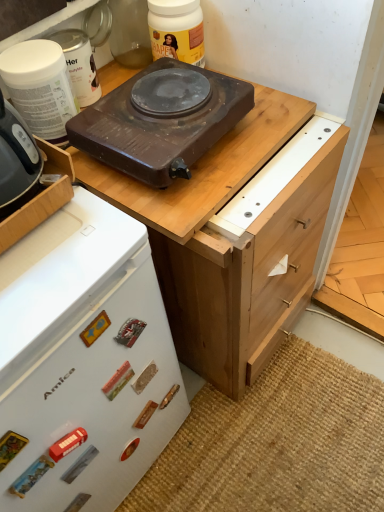
Question: Does brown wooden chest of drawers at upper center have a larger size compared to light brown wood drawer at right?

Choices:
 (A) yes
 (B) no

Answer: (A)

Question: Does brown wooden chest of drawers at upper center touch light brown wood drawer at right?

Choices:
 (A) yes
 (B) no

Answer: (A)

Question: Considering the relative positions of brown wooden chest of drawers at upper center and light brown wood drawer at right in the image provided, is brown wooden chest of drawers at upper center to the right of light brown wood drawer at right from the viewer's perspective?

Choices:
 (A) yes
 (B) no

Answer: (B)

Question: Is brown wooden chest of drawers at upper center turned away from light brown wood drawer at right?

Choices:
 (A) yes
 (B) no

Answer: (B)

Question: From the image's perspective, is brown wooden chest of drawers at upper center over light brown wood drawer at right?

Choices:
 (A) no
 (B) yes

Answer: (A)

Question: Is brown wooden chest of drawers at upper center in front of light brown wood drawer at right?

Choices:
 (A) yes
 (B) no

Answer: (A)

Question: Is brown wooden chest of drawers at upper center to the right of brown matte electric stove at upper center, the 3th kitchen appliance viewed from the left, from the viewer's perspective?

Choices:
 (A) yes
 (B) no

Answer: (A)

Question: Is brown wooden chest of drawers at upper center oriented towards brown matte electric stove at upper center, positioned as the second kitchen appliance in right-to-left order?

Choices:
 (A) no
 (B) yes

Answer: (A)

Question: Is brown wooden chest of drawers at upper center closer to the viewer compared to brown matte electric stove at upper center, the 3th kitchen appliance viewed from the left?

Choices:
 (A) yes
 (B) no

Answer: (B)

Question: Can you confirm if brown wooden chest of drawers at upper center is thinner than brown matte electric stove at upper center, positioned as the second kitchen appliance in right-to-left order?

Choices:
 (A) no
 (B) yes

Answer: (A)

Question: Could brown matte electric stove at upper center, the 3th kitchen appliance viewed from the left, be considered to be inside brown wooden chest of drawers at upper center?

Choices:
 (A) yes
 (B) no

Answer: (B)

Question: Is brown wooden chest of drawers at upper center behind brown matte electric stove at upper center, the 3th kitchen appliance viewed from the left?

Choices:
 (A) yes
 (B) no

Answer: (A)

Question: Considering the relative sizes of brown wooden chest of drawers at upper center and white plastic container at upper left, the 4th kitchen appliance from the right, in the image provided, is brown wooden chest of drawers at upper center bigger than white plastic container at upper left, the 4th kitchen appliance from the right,?

Choices:
 (A) no
 (B) yes

Answer: (B)